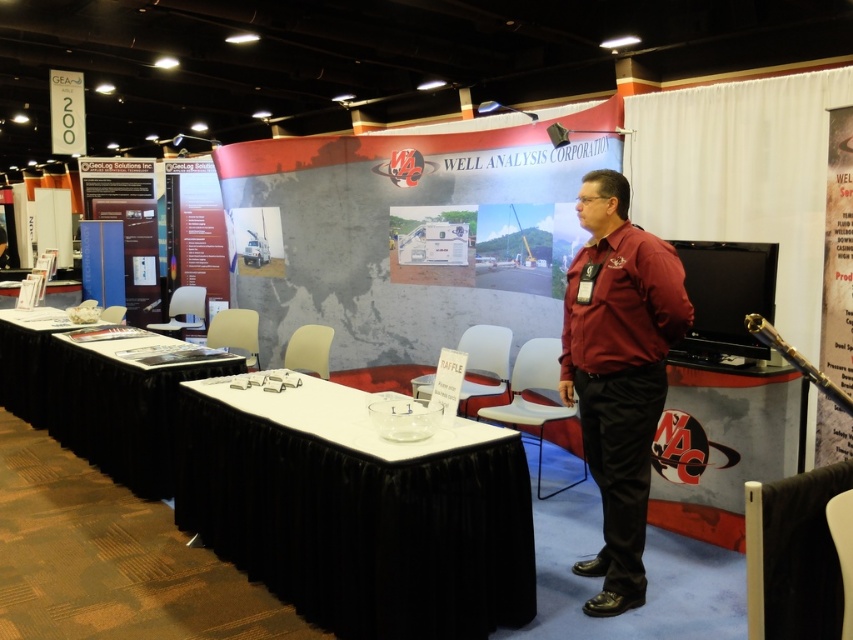
Is point (393, 486) farther from camera compared to point (611, 465)?

No, it is in front of (611, 465).

Does point (349, 481) come in front of point (610, 307)?

Yes.

From the picture: Measure the distance between white glossy table at center and camera.

2.30 meters

In order to click on white glossy table at center in this screenshot , I will do `click(361, 522)`.

Is white glossy table at center further to the viewer compared to black fabric table at lower left?

No.

Can you confirm if white glossy table at center is positioned to the left of black fabric table at lower left?

In fact, white glossy table at center is to the right of black fabric table at lower left.

Where is `white glossy table at center`? The image size is (853, 640). white glossy table at center is located at coordinates (361, 522).

Is maroon shirt at center above black fabric table at lower left?

Indeed, maroon shirt at center is positioned over black fabric table at lower left.

Does maroon shirt at center have a greater height compared to black fabric table at lower left?

Correct, maroon shirt at center is much taller as black fabric table at lower left.

Measure the distance between point (601, 352) and camera.

The distance of point (601, 352) from camera is 2.69 meters.

Find the location of a particular element. This screenshot has height=640, width=853. maroon shirt at center is located at coordinates (618, 372).